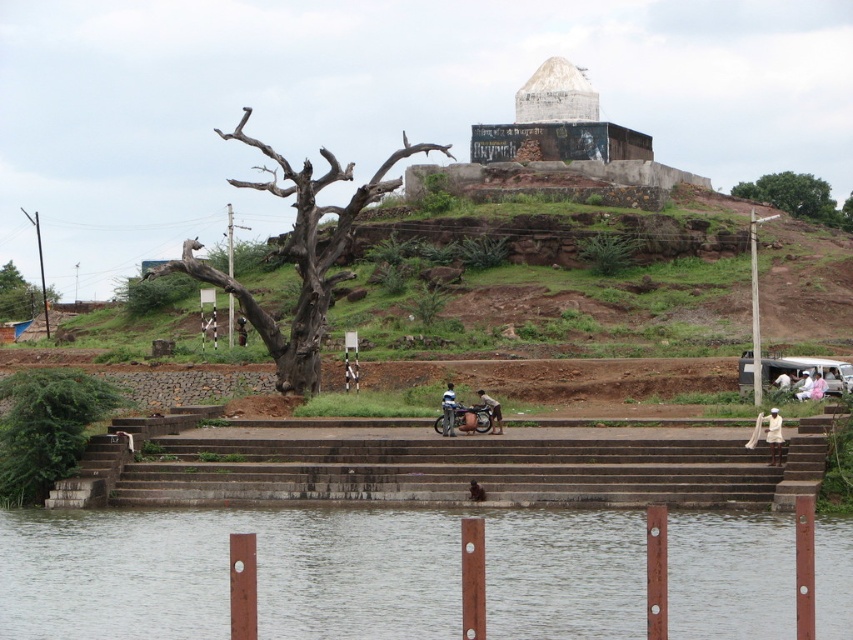
You are planning to place a decorative bench between the brown metallic poles at lower center and the green leafy tree at upper right. Considering their widths, which object will require more space horizontally for the bench to fit comfortably?

The brown metallic poles at lower center will require more space horizontally because their width surpasses that of the green leafy tree at upper right.

You are standing at the edge of the water in the serene outdoor scene. There are brown metallic poles at lower center. Where would you look to find the point located at coordinates (227,572)?

The point at coordinates (227,572) corresponds to the brown metallic poles at lower center.